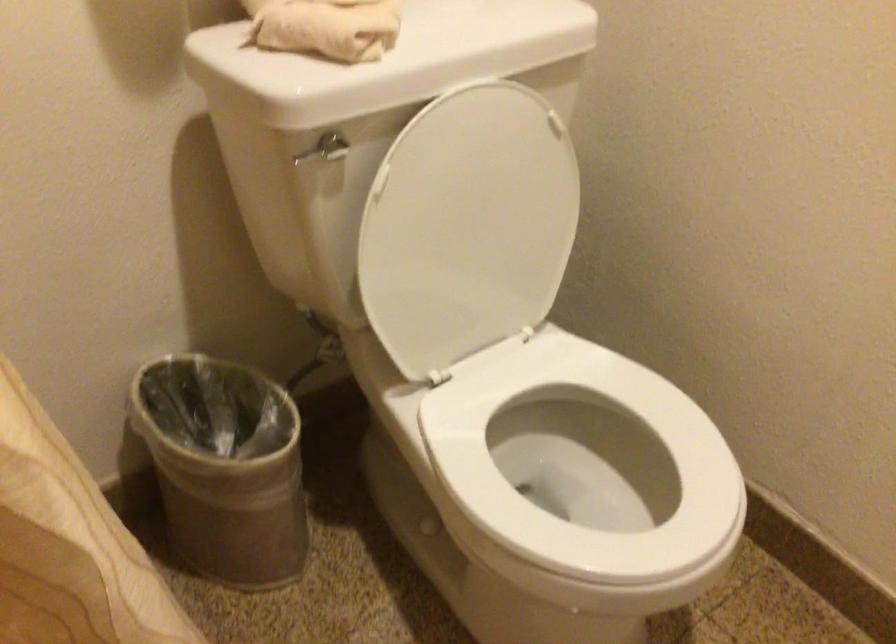
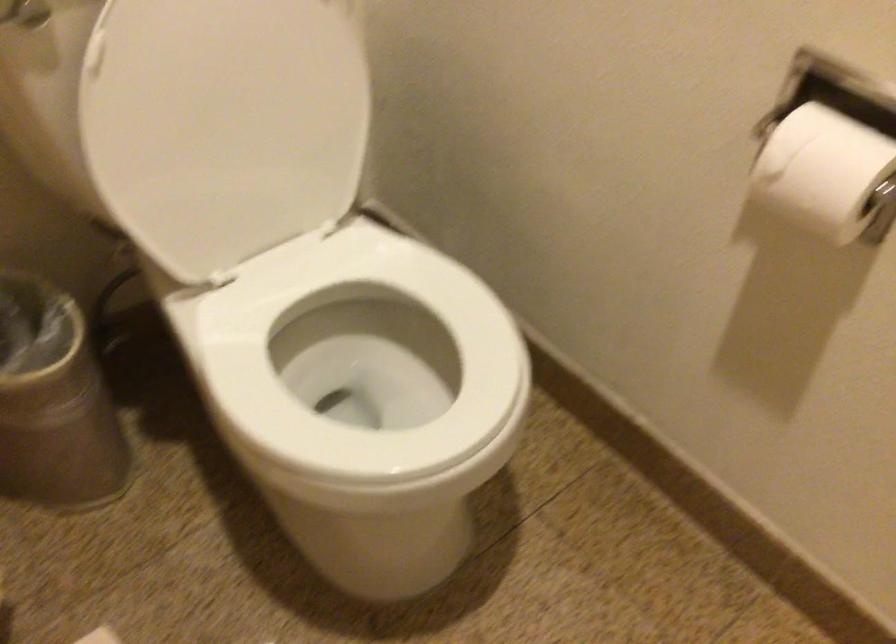
Question: The images are taken continuously from a first-person perspective. In which direction is your viewpoint rotating?

Choices:
 (A) Left
 (B) Right
 (C) Up
 (D) Down

Answer: (D)